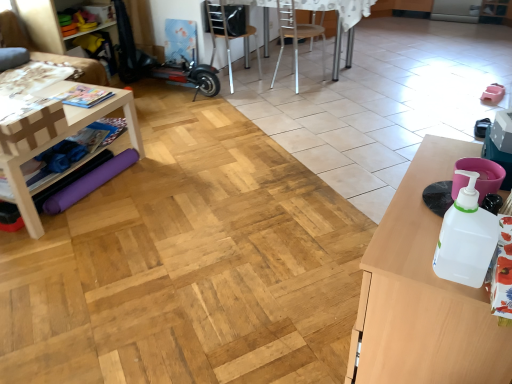
Image resolution: width=512 pixels, height=384 pixels. In order to click on free spot in front of white wood table at left, marked as the first table in a back-to-front arrangement in this screenshot , I will do `click(71, 255)`.